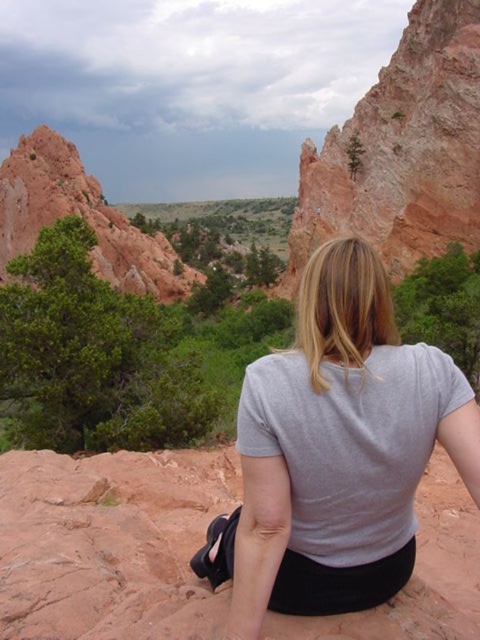
Is point (363, 202) positioned behind point (47, 188)?

No.

Which is above, rustic sandstone cliff at upper right or matte reddish rock formation at upper left?

rustic sandstone cliff at upper right is higher up.

You are a GUI agent. You are given a task and a screenshot of the screen. Output one action in this format:
    pyautogui.click(x=<x>, y=<y>)
    Task: Click on the rustic sandstone cliff at upper right
    The width and height of the screenshot is (480, 640).
    Given the screenshot: What is the action you would take?
    pyautogui.click(x=402, y=150)

Who is positioned more to the left, gray cotton shirt at center or rustic sandstone cliff at upper right?

gray cotton shirt at center

Can you confirm if gray cotton shirt at center is positioned to the right of rustic sandstone cliff at upper right?

In fact, gray cotton shirt at center is to the left of rustic sandstone cliff at upper right.

You are a GUI agent. You are given a task and a screenshot of the screen. Output one action in this format:
    pyautogui.click(x=<x>, y=<y>)
    Task: Click on the gray cotton shirt at center
    The height and width of the screenshot is (640, 480).
    Given the screenshot: What is the action you would take?
    pyautogui.click(x=336, y=451)

The image size is (480, 640). I want to click on gray cotton shirt at center, so click(x=336, y=451).

Does gray cotton shirt at center come behind matte reddish rock formation at upper left?

No, it is not.

Which is above, gray cotton shirt at center or matte reddish rock formation at upper left?

matte reddish rock formation at upper left

Who is more forward, [463,449] or [4,243]?

Point [463,449] is more forward.

Where is `gray cotton shirt at center`? Image resolution: width=480 pixels, height=640 pixels. gray cotton shirt at center is located at coordinates (336, 451).